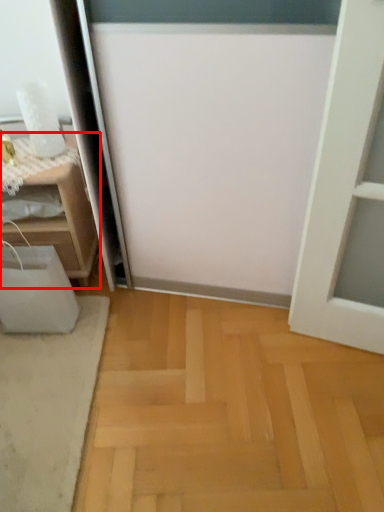
Question: Considering the relative positions of furniture (annotated by the red box) and doormat in the image provided, where is furniture (annotated by the red box) located with respect to the staircase?

Choices:
 (A) right
 (B) left

Answer: (B)